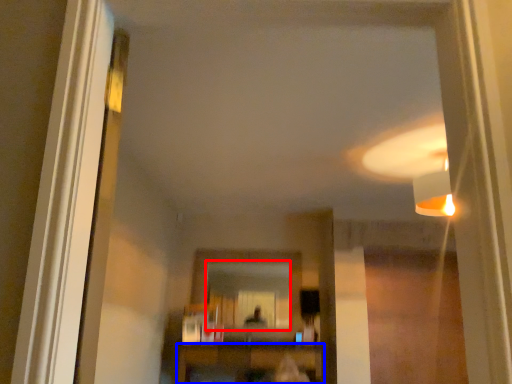
Question: Among these objects, which one is nearest to the camera, mirror (highlighted by a red box) or furniture (highlighted by a blue box)?

Choices:
 (A) mirror
 (B) furniture

Answer: (B)